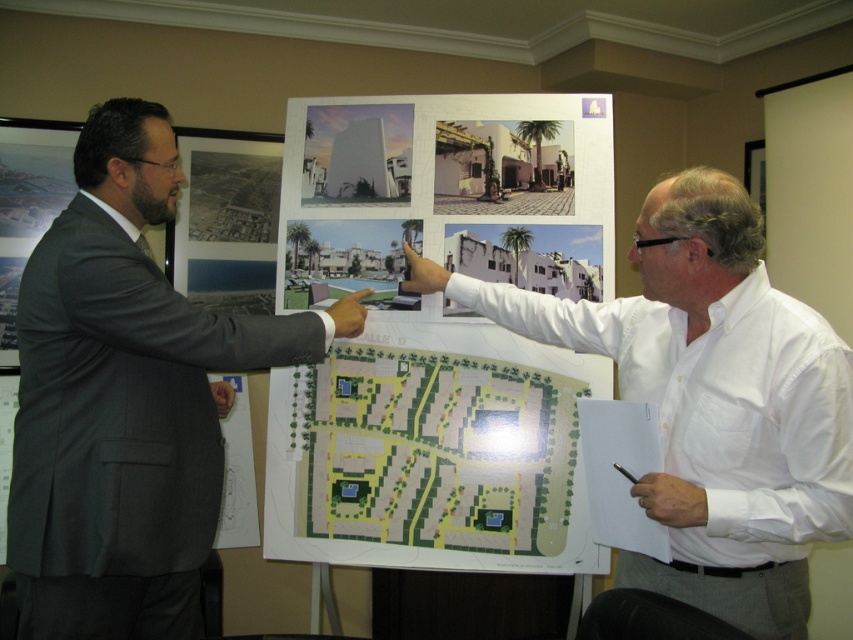
Based on the scene description, which object is wider, the dark gray suit at left or the green paper map at center?

The green paper map at center is wider than the dark gray suit at left.

You are standing in the office and want to reach the point on the architectural plan that is 5.51 feet away from you. Which direction should you move to get closer to point (219, 324)?

You should move forward towards the whiteboard since the point is 5.51 feet away from you, indicating it is located on the whiteboard in front of you.